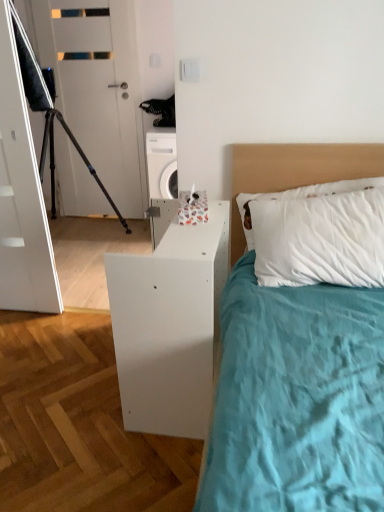
The image size is (384, 512). What are the coordinates of `vacant area on top of white matte nightstand at lower right (from a real-world perspective)` in the screenshot? It's located at (191, 231).